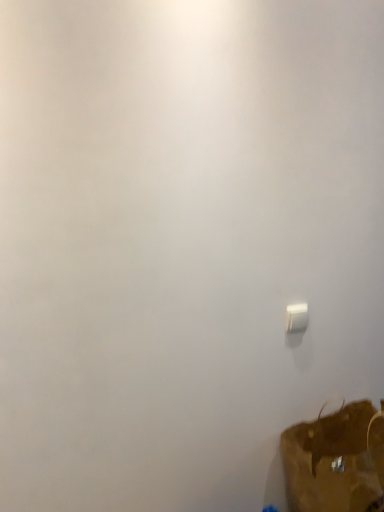
What is the approximate height of white plastic light switch at lower right?

It is 4.32 inches.

Describe the element at coordinates (296, 317) in the screenshot. I see `white plastic light switch at lower right` at that location.

This screenshot has height=512, width=384. In order to click on white plastic light switch at lower right in this screenshot , I will do `click(296, 317)`.

In order to face brown fabric luggage at lower right, should I rotate leftwards or rightwards?

Rotate your view right by about 20.708°.

Locate an element on the screen. This screenshot has height=512, width=384. brown fabric luggage at lower right is located at coordinates (336, 461).

Measure the distance between point (378, 420) and camera.

The depth of point (378, 420) is 5.27 feet.

The width and height of the screenshot is (384, 512). What do you see at coordinates (336, 461) in the screenshot?
I see `brown fabric luggage at lower right` at bounding box center [336, 461].

Where is `white plastic light switch at lower right`? The height and width of the screenshot is (512, 384). white plastic light switch at lower right is located at coordinates (296, 317).

Between white plastic light switch at lower right and brown fabric luggage at lower right, which one appears on the right side from the viewer's perspective?

brown fabric luggage at lower right.

Is white plastic light switch at lower right closer to camera compared to brown fabric luggage at lower right?

No, white plastic light switch at lower right is behind brown fabric luggage at lower right.

Which is behind, point (286, 319) or point (336, 479)?

The point (286, 319) is behind.

From the image's perspective, is white plastic light switch at lower right located above brown fabric luggage at lower right?

Yes.

From a real-world perspective, is white plastic light switch at lower right physically below brown fabric luggage at lower right?

No.

Is white plastic light switch at lower right wider than brown fabric luggage at lower right?

No, white plastic light switch at lower right is not wider than brown fabric luggage at lower right.

Which of these two, white plastic light switch at lower right or brown fabric luggage at lower right, stands taller?

Standing taller between the two is brown fabric luggage at lower right.

Is white plastic light switch at lower right bigger than brown fabric luggage at lower right?

No, white plastic light switch at lower right is not bigger than brown fabric luggage at lower right.

Looking at this image, is white plastic light switch at lower right inside the boundaries of brown fabric luggage at lower right, or outside?

white plastic light switch at lower right lies outside brown fabric luggage at lower right.

Is white plastic light switch at lower right far from brown fabric luggage at lower right?

No, white plastic light switch at lower right is in close proximity to brown fabric luggage at lower right.

In the scene shown: Does white plastic light switch at lower right turn towards brown fabric luggage at lower right?

No, white plastic light switch at lower right does not turn towards brown fabric luggage at lower right.

Locate an element on the screen. luggage and bags lying below the white plastic light switch at lower right (from the image's perspective) is located at coordinates (336, 461).

Is brown fabric luggage at lower right at the left side of white plastic light switch at lower right?

Incorrect, brown fabric luggage at lower right is not on the left side of white plastic light switch at lower right.

Between brown fabric luggage at lower right and white plastic light switch at lower right, which one is positioned behind?

white plastic light switch at lower right is further from the camera.

Which is less distant, (338, 483) or (300, 312)?

Point (338, 483) is positioned closer to the camera compared to point (300, 312).

From the image's perspective, which is below, brown fabric luggage at lower right or white plastic light switch at lower right?

brown fabric luggage at lower right appears lower in the image.

From a real-world perspective, is brown fabric luggage at lower right physically located above or below white plastic light switch at lower right?

brown fabric luggage at lower right is below white plastic light switch at lower right.

Consider the image. Does brown fabric luggage at lower right have a lesser width compared to white plastic light switch at lower right?

In fact, brown fabric luggage at lower right might be wider than white plastic light switch at lower right.

In terms of height, does brown fabric luggage at lower right look taller or shorter compared to white plastic light switch at lower right?

brown fabric luggage at lower right is taller than white plastic light switch at lower right.

Considering the sizes of brown fabric luggage at lower right and white plastic light switch at lower right in the image, is brown fabric luggage at lower right bigger or smaller than white plastic light switch at lower right?

brown fabric luggage at lower right is bigger than white plastic light switch at lower right.

Is brown fabric luggage at lower right surrounding white plastic light switch at lower right?

Definitely not — white plastic light switch at lower right is not inside brown fabric luggage at lower right.

Would you consider brown fabric luggage at lower right to be distant from white plastic light switch at lower right?

brown fabric luggage at lower right is actually quite close to white plastic light switch at lower right.

Is brown fabric luggage at lower right looking in the opposite direction of white plastic light switch at lower right?

No, brown fabric luggage at lower right's orientation is not away from white plastic light switch at lower right.

In the image, there is a white plastic light switch at lower right. Where is `luggage and bags below it (from the image's perspective)`? This screenshot has width=384, height=512. luggage and bags below it (from the image's perspective) is located at coordinates (336, 461).

This screenshot has height=512, width=384. I want to click on luggage and bags lying in front of the white plastic light switch at lower right, so click(336, 461).

Locate an element on the screen. Image resolution: width=384 pixels, height=512 pixels. light switch that is above the brown fabric luggage at lower right (from the image's perspective) is located at coordinates (296, 317).